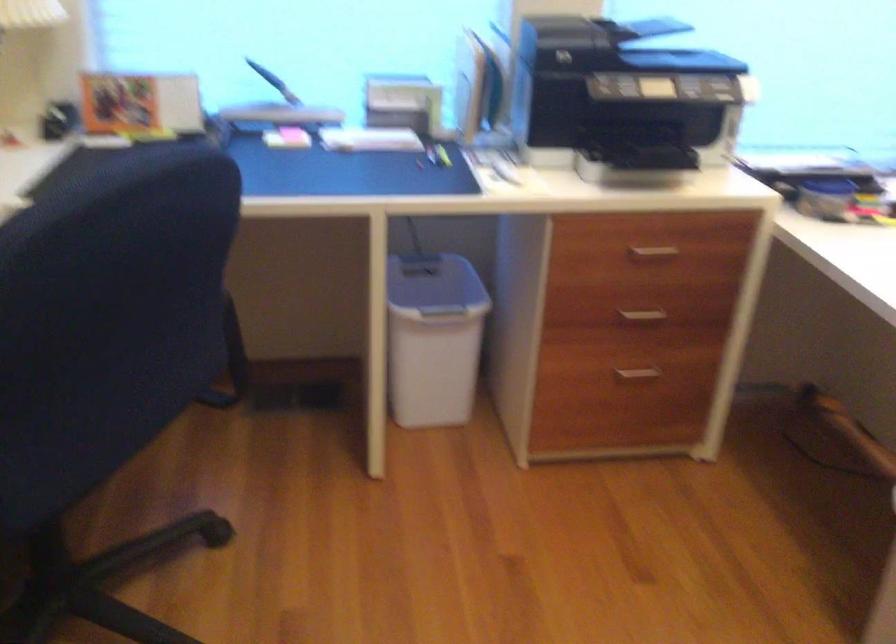
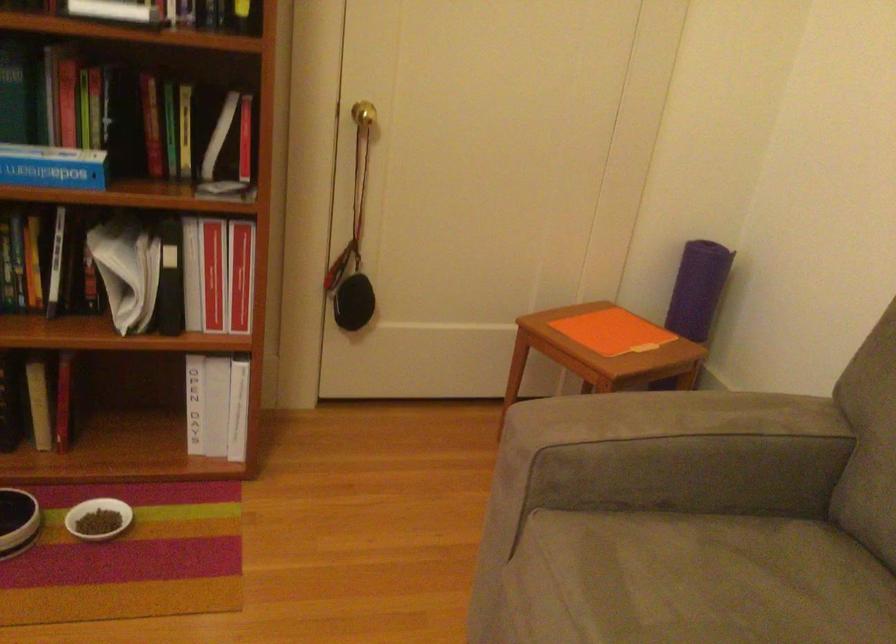
Based on the continuous images, in which direction is the camera rotating?

The camera's rotation is toward right-down.